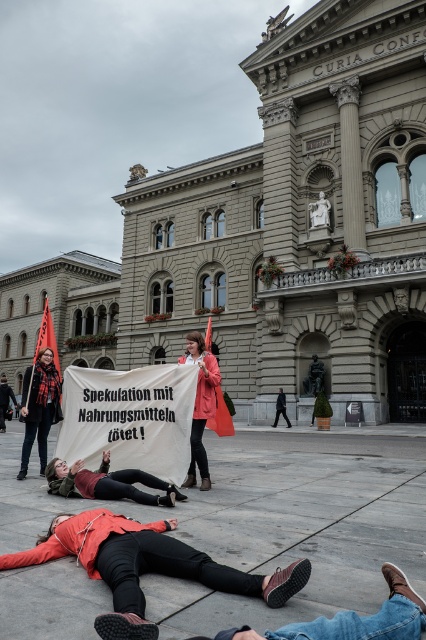
You are a photographer trying to capture a closeup of the orange fabric coat at lower center and the matte black scarf at left. Given their sizes, which object would require you to move closer to fill the frame?

The orange fabric coat at lower center occupies less space than the matte black scarf at left, so you would need to move closer to the orange fabric coat at lower center to fill the frame.

Consider the image. You are a journalist taking photos of the protest scene. You see the matte black scarf at left and the matte pink coat at center. Which object is closer to the ground?

The matte black scarf at left is located below the matte pink coat at center, so it is closer to the ground.

You are a journalist taking photos of the protest scene. You notice two people in the foreground wearing a matte black scarf at left and a matte pink coat at center. Based on their positions, which one is closer to the left side of the image?

The matte black scarf at left is positioned to the left of the matte pink coat at center, so the matte black scarf at left is closer to the left side of the image.